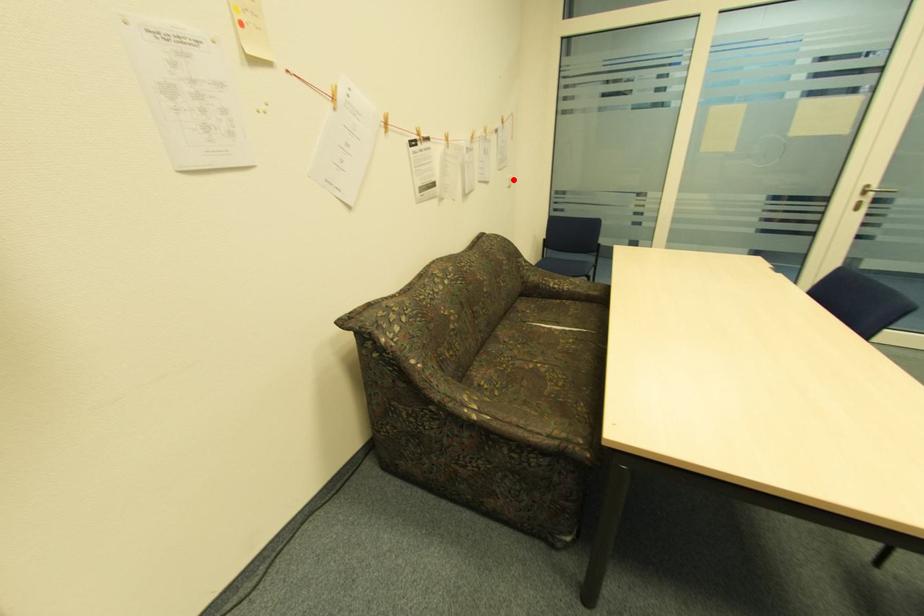
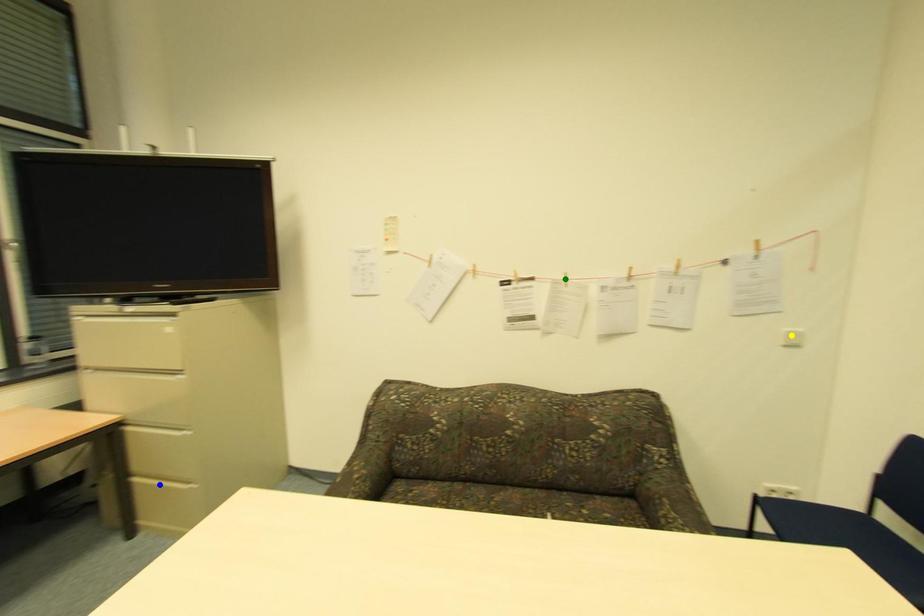
Question: I am providing you with two images of the same scene from different viewpoints. A red point is marked on the first image. You are given multiple points on the second image. Which mark in image 2 goes with the point in image 1?

Choices:
 (A) yellow point
 (B) green point
 (C) blue point

Answer: (A)